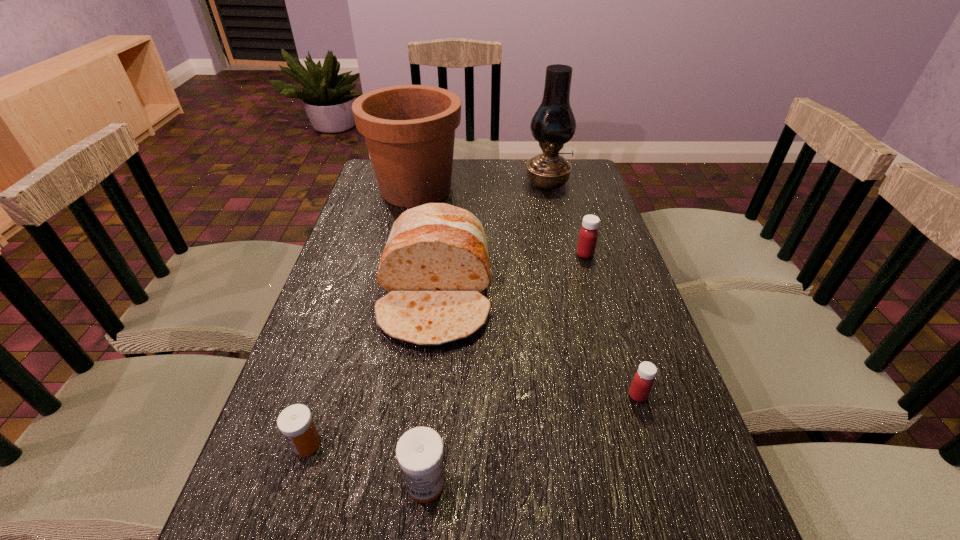
This screenshot has width=960, height=540. I want to click on the tallest object, so click(x=553, y=124).

At what (x,y) coordinates should I click in order to perform the action: click on brown oil lamp. Please return your answer as a coordinate pair (x, y). Looking at the image, I should click on (553, 124).

Find the location of a particular element. Image resolution: width=960 pixels, height=540 pixels. the second tallest object is located at coordinates (409, 130).

Locate an element on the screen. Image resolution: width=960 pixels, height=540 pixels. bread is located at coordinates (435, 265).

Locate an element on the screen. The image size is (960, 540). the nearest medicine is located at coordinates (419, 451).

Where is `the bigger white medicine`? This screenshot has width=960, height=540. the bigger white medicine is located at coordinates (419, 451).

The width and height of the screenshot is (960, 540). Find the location of `the farther red medicine`. the farther red medicine is located at coordinates (588, 235).

At what (x,y) coordinates should I click in order to perform the action: click on the farthest medicine. Please return your answer as a coordinate pair (x, y). Looking at the image, I should click on (588, 235).

Find the location of `the second farthest medicine`. the second farthest medicine is located at coordinates (643, 380).

This screenshot has width=960, height=540. Find the location of `the fifth farthest object`. the fifth farthest object is located at coordinates (643, 380).